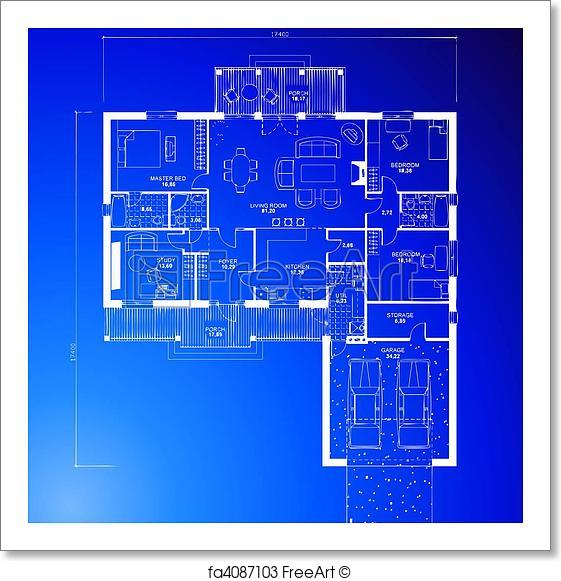
Identify the location of living room. (272, 177), (340, 157), (234, 139), (240, 196).